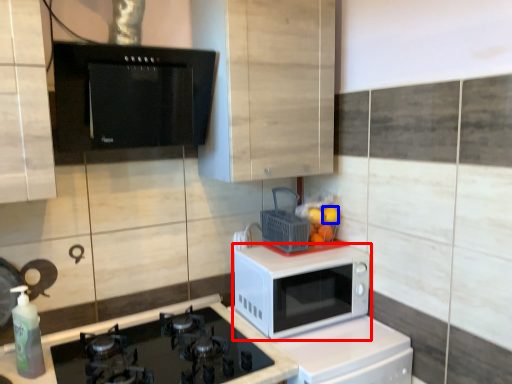
Question: Which point is further to the camera, microwave oven (highlighted by a red box) or orange (highlighted by a blue box)?

Choices:
 (A) microwave oven
 (B) orange

Answer: (B)